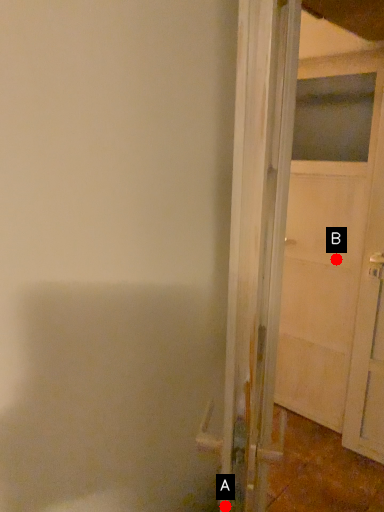
Question: Two points are circled on the image, labeled by A and B beside each circle. Which point appears farthest from the camera in this image?

Choices:
 (A) A is further
 (B) B is further

Answer: (B)